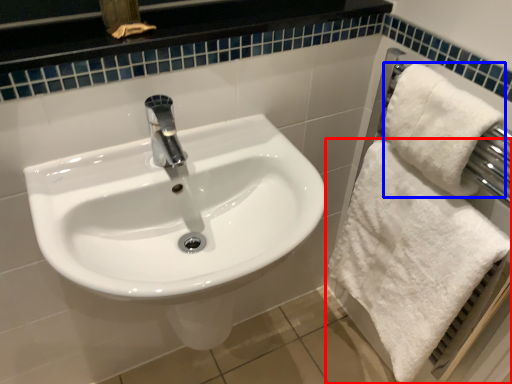
Question: Among these objects, which one is farthest to the camera, towel (highlighted by a red box) or bath towel (highlighted by a blue box)?

Choices:
 (A) towel
 (B) bath towel

Answer: (A)